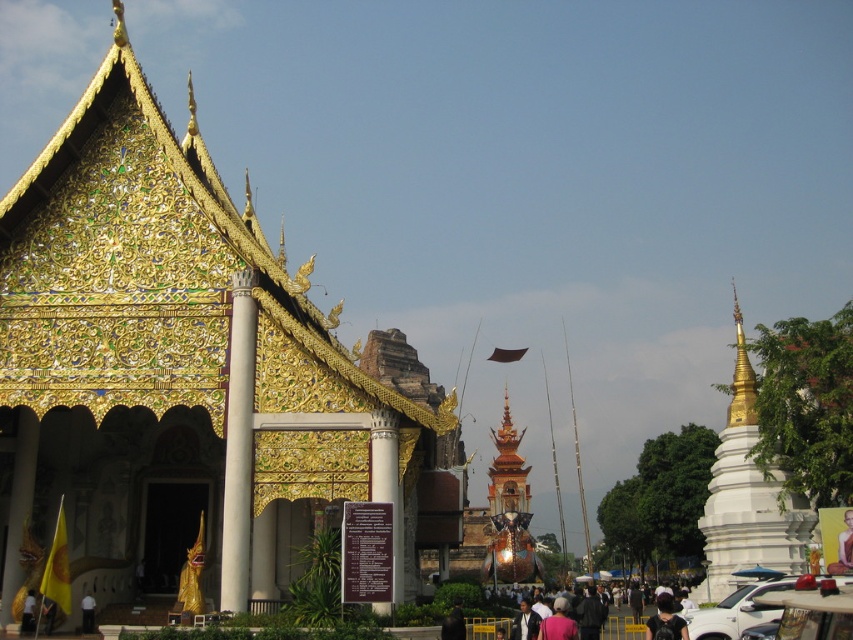
You are standing at the entrance of the temple complex and see the white polished stone pillar at center and the white matte person at center. Which object is nearer to you?

The white polished stone pillar at center is closer to the viewer than the white matte person at center.

You are standing at the entrance of the grand temple with golden roof and want to take a photo of the point at coordinate point (380, 456). The camera you are using has a maximum focus range of 200 feet. Will the camera be able to focus on the point?

The point at coordinate point (380, 456) is 202.58 feet from the camera, which exceeds the maximum focus range of 200 feet. Therefore, the camera will not be able to focus on the point.